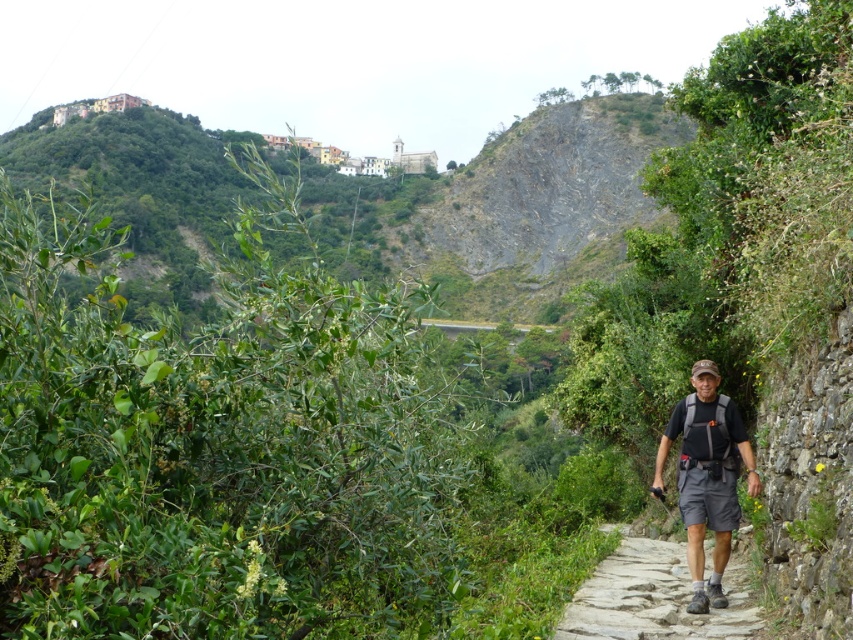
Which is more to the left, gray stone path at center or dark gray fabric backpack at center?

Positioned to the left is gray stone path at center.

Is gray stone path at center smaller than dark gray fabric backpack at center?

Actually, gray stone path at center might be larger than dark gray fabric backpack at center.

The height and width of the screenshot is (640, 853). Identify the location of gray stone path at center. (653, 596).

Locate an element on the screen. This screenshot has height=640, width=853. gray stone path at center is located at coordinates (653, 596).